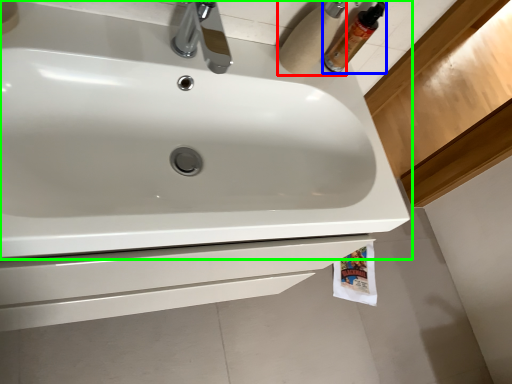
Question: Based on their relative distances, which object is farther from toilet paper (highlighted by a red box)? Choose from mouthwash (highlighted by a blue box) and sink (highlighted by a green box).

Choices:
 (A) mouthwash
 (B) sink

Answer: (B)